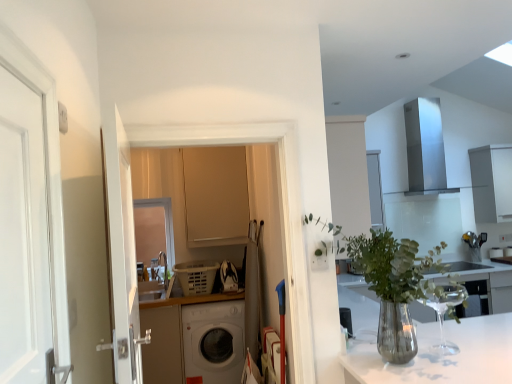
Image resolution: width=512 pixels, height=384 pixels. Find the location of `matte beige cabinet at center, which is counted as the first cabinetry, starting from the left`. matte beige cabinet at center, which is counted as the first cabinetry, starting from the left is located at coordinates (216, 195).

Locate an element on the screen. translucent glass vase at center is located at coordinates (395, 285).

What do you see at coordinates (465, 266) in the screenshot? The height and width of the screenshot is (384, 512). I see `white glossy sink at center` at bounding box center [465, 266].

At what (x,y) coordinates should I click in order to perform the action: click on white matte washing machine at center. Please return your answer as a coordinate pair (x, y). Looking at the image, I should click on [214, 341].

Describe the element at coordinates (492, 182) in the screenshot. I see `white matte cabinet at upper right, which is the first cabinetry from right to left` at that location.

The image size is (512, 384). Identify the location of matte beige cabinet at center, which is counted as the first cabinetry, starting from the left. (216, 195).

Could you tell me if white matte cabinet at upper right, which is the second cabinetry from front to back, is facing translucent glass vase at center?

No, white matte cabinet at upper right, which is the second cabinetry from front to back, does not turn towards translucent glass vase at center.

Which is farther, (497, 215) or (409, 325)?

The point (497, 215) is farther.

From a real-world perspective, which object stands above the other?

white matte cabinet at upper right, which is the second cabinetry from front to back, is physically above.

At what (x,y) coordinates should I click in order to perform the action: click on the 2nd cabinetry behind the translucent glass vase at center. Please return your answer as a coordinate pair (x, y). The width and height of the screenshot is (512, 384). Looking at the image, I should click on (492, 182).

Is point (240, 215) less distant than point (205, 375)?

No.

Is matte beige cabinet at center, the first cabinetry in the front-to-back sequence, in contact with white matte washing machine at center?

No, matte beige cabinet at center, the first cabinetry in the front-to-back sequence, is not touching white matte washing machine at center.

This screenshot has width=512, height=384. Identify the location of cabinetry on the left of the white matte washing machine at center. [x=216, y=195].

From the picture: Choose the correct answer: Is matte beige cabinet at center, which is the second cabinetry from back to front, inside white matte washing machine at center or outside it?

matte beige cabinet at center, which is the second cabinetry from back to front, is not inside white matte washing machine at center, it's outside.

Which object is more forward, white glossy sink at center or matte beige cabinet at center, which is counted as the first cabinetry, starting from the left?

Positioned in front is matte beige cabinet at center, which is counted as the first cabinetry, starting from the left.

Considering the positions of point (426, 274) and point (234, 168), is point (426, 274) closer or farther from the camera than point (234, 168)?

Point (426, 274) appears to be closer to the viewer than point (234, 168).

Is white glossy sink at center not within matte beige cabinet at center, which is the second cabinetry from back to front?

Yes, white glossy sink at center is outside of matte beige cabinet at center, which is the second cabinetry from back to front.

The image size is (512, 384). Find the location of `houseplant in front of the white matte washing machine at center`. houseplant in front of the white matte washing machine at center is located at coordinates (395, 285).

Is white matte washing machine at center positioned in front of translucent glass vase at center?

That is False.

Based on the photo, which is correct: white matte washing machine at center is inside translucent glass vase at center, or outside of it?

The correct answer is: outside.

Considering the positions of points (205, 367) and (401, 256), is point (205, 367) farther from camera compared to point (401, 256)?

Yes, point (205, 367) is behind point (401, 256).

Is white matte washing machine at center next to white matte cabinet at upper right, which is counted as the 1th cabinetry, starting from the back?

No, white matte washing machine at center is not beside white matte cabinet at upper right, which is counted as the 1th cabinetry, starting from the back.

Is white matte washing machine at center facing away from white matte cabinet at upper right, which is the second cabinetry from front to back?

No, white matte washing machine at center's orientation is not away from white matte cabinet at upper right, which is the second cabinetry from front to back.

Is point (202, 359) closer to camera compared to point (487, 209)?

Yes, it is.

Considering the relative sizes of white matte washing machine at center and white matte cabinet at upper right, which is the first cabinetry from right to left, in the image provided, is white matte washing machine at center thinner than white matte cabinet at upper right, which is the first cabinetry from right to left,?

In fact, white matte washing machine at center might be wider than white matte cabinet at upper right, which is the first cabinetry from right to left.

Is white glossy sink at center to the right of white matte cabinet at upper right, which is the second cabinetry from front to back, from the viewer's perspective?

Incorrect, white glossy sink at center is not on the right side of white matte cabinet at upper right, which is the second cabinetry from front to back.

Can you confirm if white glossy sink at center is smaller than white matte cabinet at upper right, which is the second cabinetry from left to right?

Indeed, white glossy sink at center has a smaller size compared to white matte cabinet at upper right, which is the second cabinetry from left to right.

What's the angular difference between white glossy sink at center and white matte cabinet at upper right, which is the second cabinetry from left to right,'s facing directions?

The facing directions of white glossy sink at center and white matte cabinet at upper right, which is the second cabinetry from left to right, are 0.166 degrees apart.

Is white glossy sink at center facing away from white matte cabinet at upper right, which is the first cabinetry from right to left?

white glossy sink at center is not turned away from white matte cabinet at upper right, which is the first cabinetry from right to left.

Which is correct: white matte cabinet at upper right, which is counted as the 1th cabinetry, starting from the back, is inside white glossy sink at center, or outside of it?

white matte cabinet at upper right, which is counted as the 1th cabinetry, starting from the back, is not inside white glossy sink at center, it's outside.

Can you confirm if white matte cabinet at upper right, which is the first cabinetry from right to left, is wider than white glossy sink at center?

In fact, white matte cabinet at upper right, which is the first cabinetry from right to left, might be narrower than white glossy sink at center.

Measure the distance from white matte cabinet at upper right, which is the first cabinetry from right to left, to white glossy sink at center.

white matte cabinet at upper right, which is the first cabinetry from right to left, and white glossy sink at center are 1.60 meters apart.

Is the position of white matte cabinet at upper right, which is counted as the 1th cabinetry, starting from the back, more distant than that of white glossy sink at center?

Yes, white matte cabinet at upper right, which is counted as the 1th cabinetry, starting from the back, is further from the camera.

Where is `houseplant that is in front of the white matte cabinet at upper right, which is the first cabinetry from right to left`? The image size is (512, 384). houseplant that is in front of the white matte cabinet at upper right, which is the first cabinetry from right to left is located at coordinates (395, 285).

This screenshot has height=384, width=512. Identify the location of cabinetry on the left of the white matte washing machine at center. (216, 195).

From the picture: Based on their spatial positions, is translucent glass vase at center or matte beige cabinet at center, which is counted as the first cabinetry, starting from the left, further from white matte washing machine at center?

Based on the image, translucent glass vase at center appears to be further to white matte washing machine at center.

From the image, which object appears to be farther from white glossy sink at center, white matte cabinet at upper right, which is the first cabinetry from right to left, or matte beige cabinet at center, marked as the 2th cabinetry in a right-to-left arrangement?

matte beige cabinet at center, marked as the 2th cabinetry in a right-to-left arrangement, lies further to white glossy sink at center than the other object.

Looking at the image, which one is located further to white matte washing machine at center, matte beige cabinet at center, which is counted as the first cabinetry, starting from the left, or white matte cabinet at upper right, which is the first cabinetry from right to left?

Among the two, white matte cabinet at upper right, which is the first cabinetry from right to left, is located further to white matte washing machine at center.

From the image, which object appears to be farther from white glossy sink at center, translucent glass vase at center or matte beige cabinet at center, marked as the 2th cabinetry in a right-to-left arrangement?

Among the two, translucent glass vase at center is located further to white glossy sink at center.

Which object lies nearer to the anchor point translucent glass vase at center, matte beige cabinet at center, which is counted as the first cabinetry, starting from the left, or white matte cabinet at upper right, which is the second cabinetry from front to back?

matte beige cabinet at center, which is counted as the first cabinetry, starting from the left, is closer to translucent glass vase at center.

Based on their spatial positions, is translucent glass vase at center or white matte washing machine at center closer to white matte cabinet at upper right, which is the second cabinetry from front to back?

white matte washing machine at center.

Which object lies nearer to the anchor point translucent glass vase at center, matte beige cabinet at center, which is the second cabinetry from back to front, or white glossy sink at center?

matte beige cabinet at center, which is the second cabinetry from back to front, lies closer to translucent glass vase at center than the other object.

Based on their spatial positions, is white matte cabinet at upper right, which is counted as the 1th cabinetry, starting from the back, or translucent glass vase at center closer to matte beige cabinet at center, marked as the 2th cabinetry in a right-to-left arrangement?

translucent glass vase at center is closer to matte beige cabinet at center, marked as the 2th cabinetry in a right-to-left arrangement.

The height and width of the screenshot is (384, 512). Find the location of `washing machine between matte beige cabinet at center, which is counted as the first cabinetry, starting from the left, and white matte cabinet at upper right, which is the second cabinetry from front to back`. washing machine between matte beige cabinet at center, which is counted as the first cabinetry, starting from the left, and white matte cabinet at upper right, which is the second cabinetry from front to back is located at coordinates (214, 341).

Identify the location of washing machine located between matte beige cabinet at center, which is the second cabinetry from back to front, and white glossy sink at center in the left-right direction. (214, 341).

Find the location of a particular element. The image size is (512, 384). sink between white matte washing machine at center and white matte cabinet at upper right, which is the first cabinetry from right to left is located at coordinates (465, 266).

This screenshot has height=384, width=512. I want to click on sink located between translucent glass vase at center and white matte cabinet at upper right, which is the second cabinetry from front to back, in the depth direction, so click(465, 266).